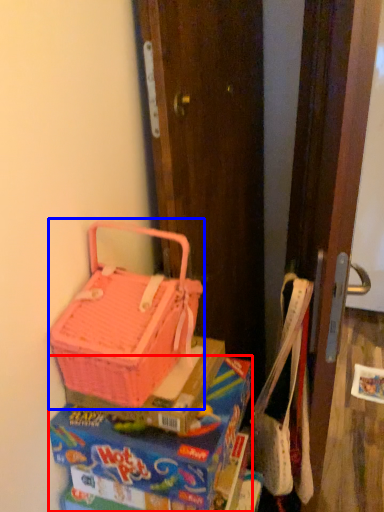
Question: Which point is closer to the camera, lunch box (highlighted by a red box) or picnic basket (highlighted by a blue box)?

Choices:
 (A) lunch box
 (B) picnic basket

Answer: (B)